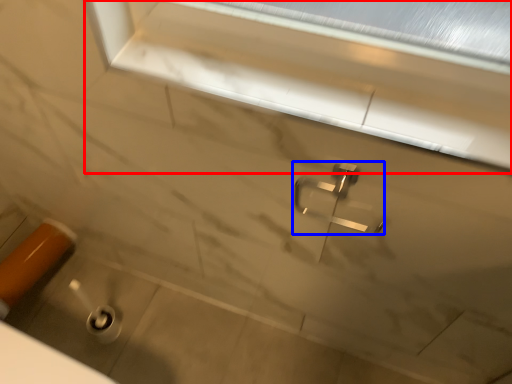
Question: Which object appears farthest to the camera in this image, window frame (highlighted by a red box) or tap (highlighted by a blue box)?

Choices:
 (A) window frame
 (B) tap

Answer: (B)